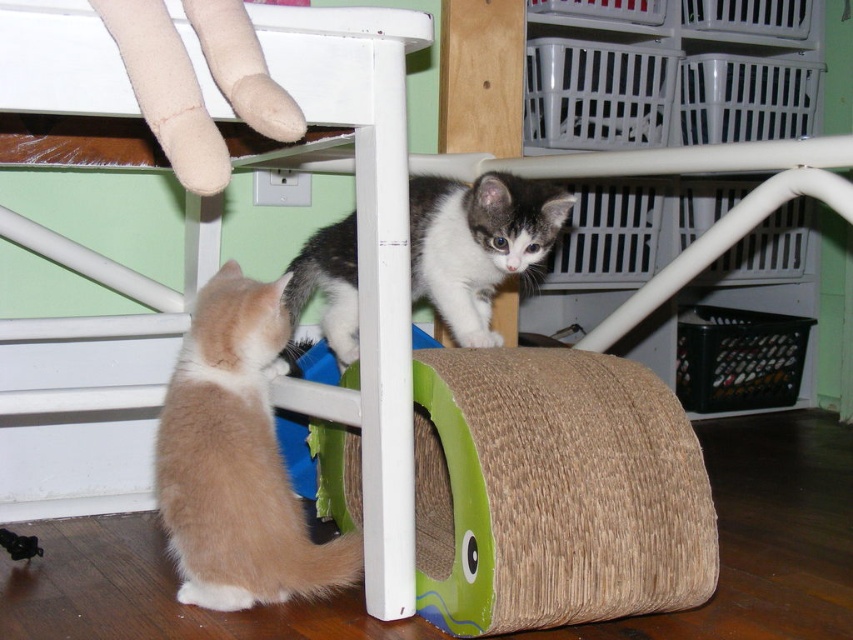
You are a photographer trying to capture a closeup of the light brown kitten with white markings on its face and paws. You notice that the camera focus point is set at coordinate point (236, 460). Based on the scene description, will this focus point be on the light brown kitten?

Yes, the focus point at (236, 460) is on the light brown kitten with white markings on its face and paws because the Objects Description states that point indicates light brown fur at lower left.